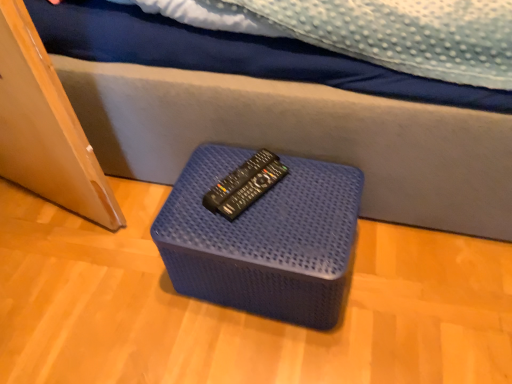
Identify the location of free space above blue woven ottoman at center (from a real-world perspective). Image resolution: width=512 pixels, height=384 pixels. click(256, 199).